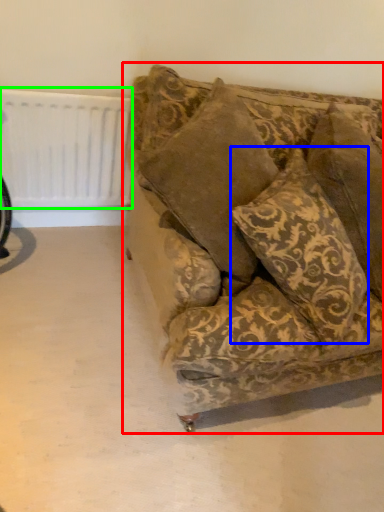
Question: Which object is the closest to the studio couch (highlighted by a red box)? Choose among these: pillow (highlighted by a blue box) or radiator (highlighted by a green box).

Choices:
 (A) pillow
 (B) radiator

Answer: (A)